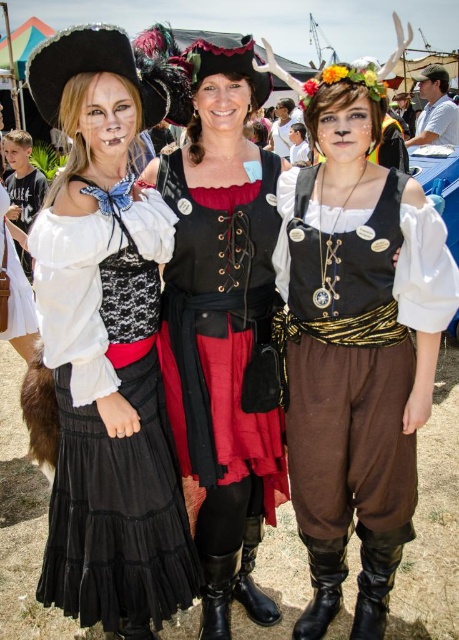
Question: Considering the relative positions of matte black dress at left and black leather vest at center in the image provided, where is matte black dress at left located with respect to black leather vest at center?

Choices:
 (A) left
 (B) right

Answer: (A)

Question: Among these objects, which one is farthest from the camera?

Choices:
 (A) black leather vest at center
 (B) matte black vest at center
 (C) matte black dress at left

Answer: (A)

Question: Is matte black dress at left to the left of white cotton shirt at upper right from the viewer's perspective?

Choices:
 (A) yes
 (B) no

Answer: (A)

Question: Can you confirm if matte black dress at left is smaller than black leather vest at center?

Choices:
 (A) yes
 (B) no

Answer: (B)

Question: Which object is closer to the camera taking this photo?

Choices:
 (A) matte black vest at center
 (B) white cotton shirt at upper right
 (C) black leather vest at center
 (D) matte black dress at left

Answer: (D)

Question: Based on their relative distances, which object is nearer to the matte black vest at center?

Choices:
 (A) matte black dress at left
 (B) black leather vest at center
 (C) white cotton shirt at upper right

Answer: (B)